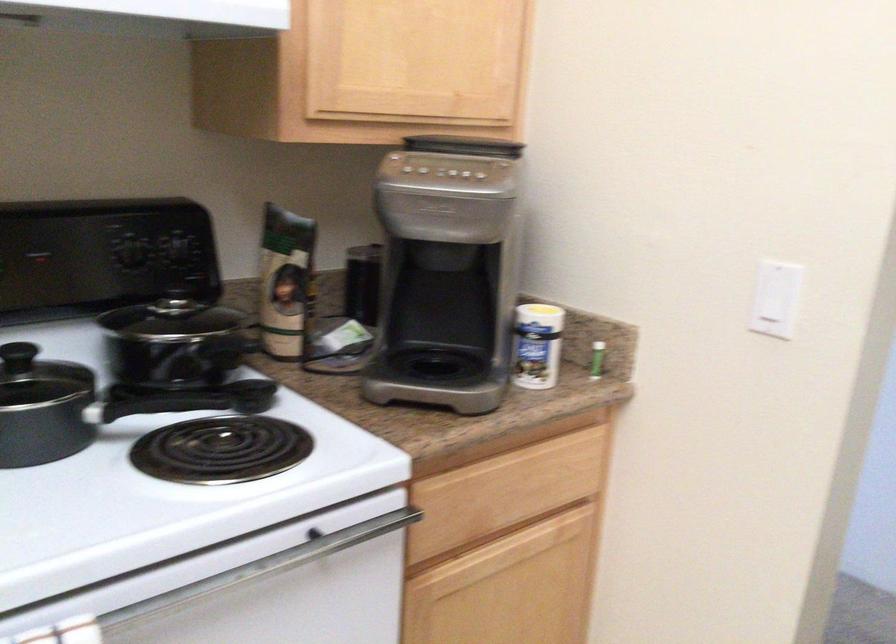
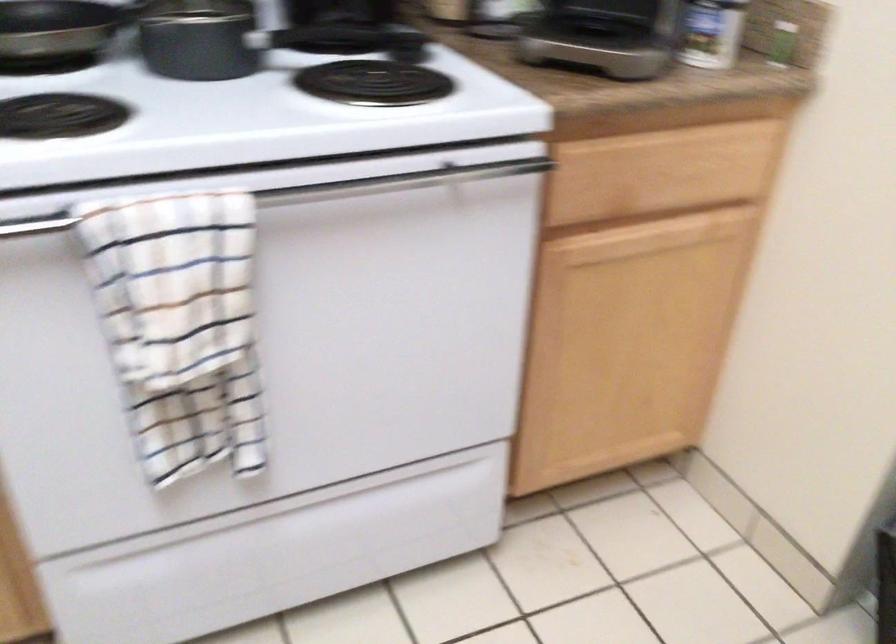
Question: Which direction would the cameraman need to move to produce the second image? Reply with the corresponding letter.

Choices:
 (A) Left
 (B) Right
 (C) Forward
 (D) Backward

Answer: (B)